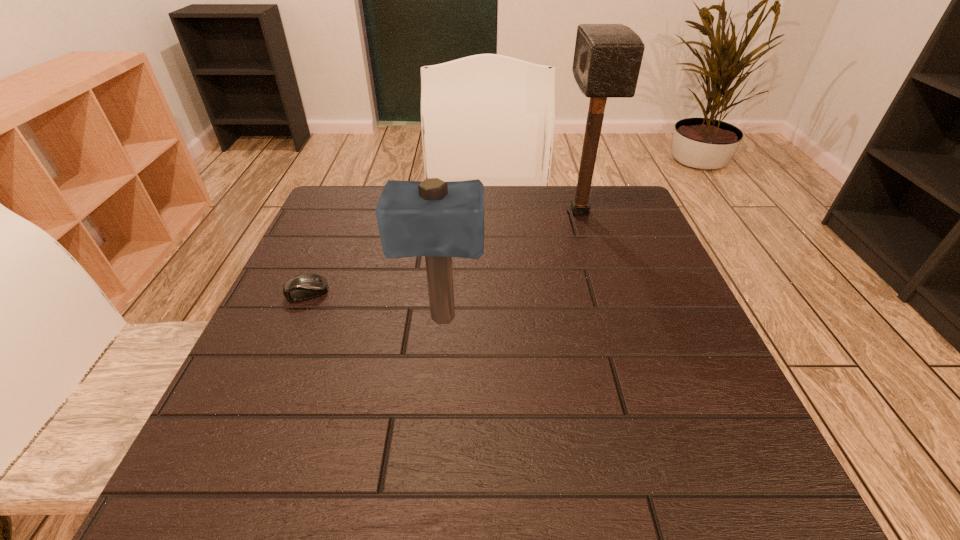
Find the location of a particular element. This screenshot has width=960, height=540. blank space that satisfies the following two spatial constraints: 1. on the front side of the mouse; 2. on the right side of the nearer mallet is located at coordinates (296, 319).

Locate an element on the screen. Image resolution: width=960 pixels, height=540 pixels. vacant region that satisfies the following two spatial constraints: 1. on the back side of the second shortest object; 2. on the right side of the right mallet is located at coordinates (451, 212).